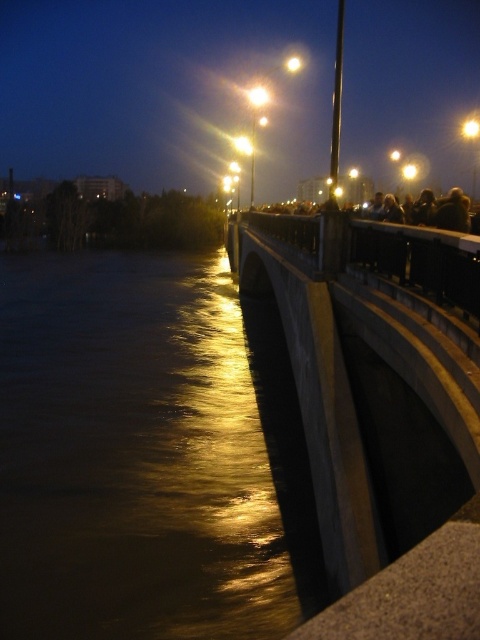
Question: Estimate the real-world distances between objects in this image. Which object is closer to the concrete at center?

Choices:
 (A) metallic bridge at center
 (B) golden reflective water at lower left

Answer: (B)

Question: Is golden reflective water at lower left closer to camera compared to metallic bridge at center?

Choices:
 (A) yes
 (B) no

Answer: (A)

Question: Which of the following is the farthest from the observer?

Choices:
 (A) golden reflective water at lower left
 (B) concrete at center
 (C) metallic bridge at center

Answer: (C)

Question: Does golden reflective water at lower left appear over metallic bridge at center?

Choices:
 (A) yes
 (B) no

Answer: (B)

Question: Is metallic bridge at center further to the viewer compared to concrete at center?

Choices:
 (A) no
 (B) yes

Answer: (B)

Question: Which point is farther from the camera taking this photo?

Choices:
 (A) (285, 246)
 (B) (142, 65)
 (C) (54, 408)

Answer: (B)